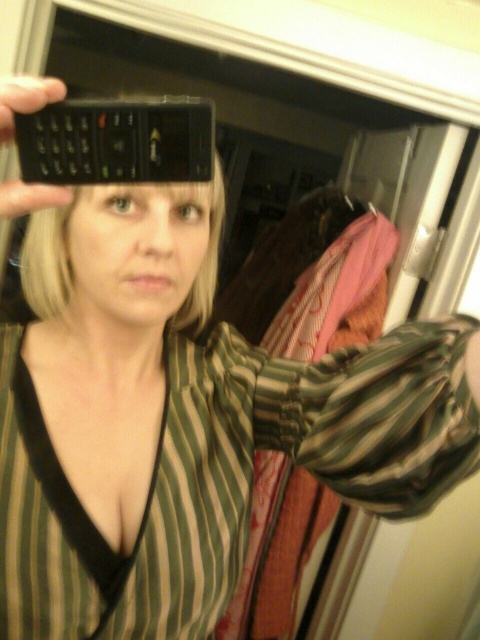
You are trying to take a selfie in a mirrored closet. You have two black matte phones available. The black matte phone at upper center and the black matte phone at upper left. Which phone should you use if you want to capture the reflection of the pink garment hanging behind you?

You should use the black matte phone at upper center because it is positioned above the black matte phone at upper left, allowing it to capture a better angle of the pink garment reflection in the mirror.

You are trying to take a selfie in a closet. You have a black matte phone at upper center. Where should you position your phone to capture the best reflection in the mirror?

The black matte phone at upper center is positioned at point (117,141), so you should hold it there to capture the best reflection in the mirror.

You are trying to decide which black matte phone to use for your selfie. The black matte phone at upper center and the black matte phone at upper left are both in your view. Which one has a larger screen size?

The black matte phone at upper center has a larger screen size because its width surpasses that of the black matte phone at upper left.